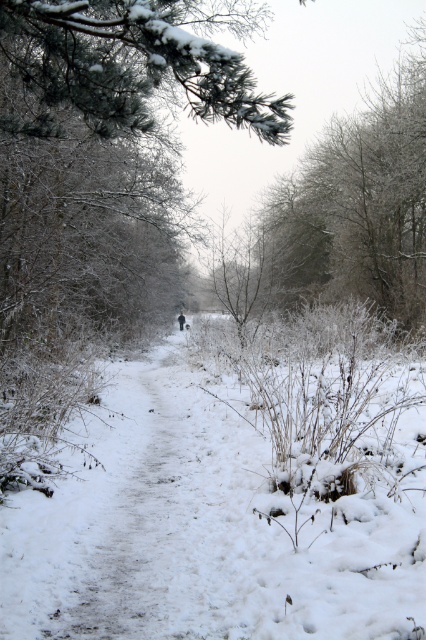
Between white fluffy snow at center and green textured pine branch at upper left, which one has less height?

Answer: white fluffy snow at center is shorter.

Based on the photo, is white fluffy snow at center to the left of green textured pine branch at upper left from the viewer's perspective?

No, white fluffy snow at center is not to the left of green textured pine branch at upper left.

The height and width of the screenshot is (640, 426). What are the coordinates of `white fluffy snow at center` in the screenshot? It's located at (230, 492).

Find the location of a particular element. The height and width of the screenshot is (640, 426). white fluffy snow at center is located at coordinates (230, 492).